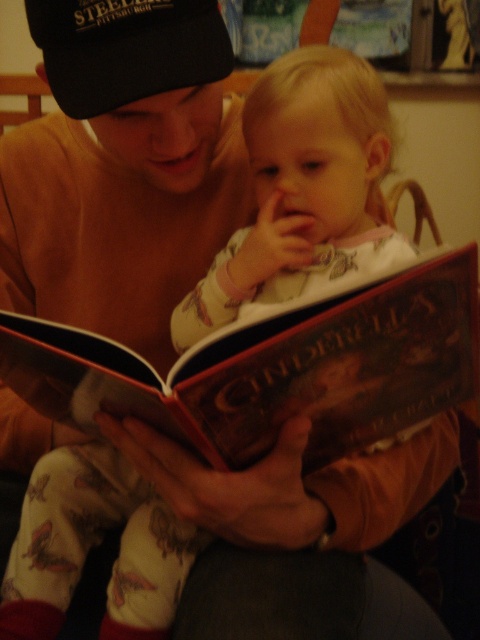
You are a delivery person who needs to place a package on the table where the hardcover book at center and the black fabric baseball cap at upper left are placed. The package requires at least 12 inches of space between the two items to avoid damage. Can you safely place the package between them?

The hardcover book at center is only 11.35 inches away from the black fabric baseball cap at upper left, which is less than the required 12 inches. Therefore, placing the package between them would risk damaging the items.

You are a parent trying to place a new toy on the table between the matte brown sweater at upper left and the hardcover book at center. The toy requires 25 centimeters of space. Is there enough space between them?

The distance between the matte brown sweater at upper left and the hardcover book at center is 26.28 centimeters, which is more than the required 25 centimeters. Therefore, there is enough space to place the toy between them.